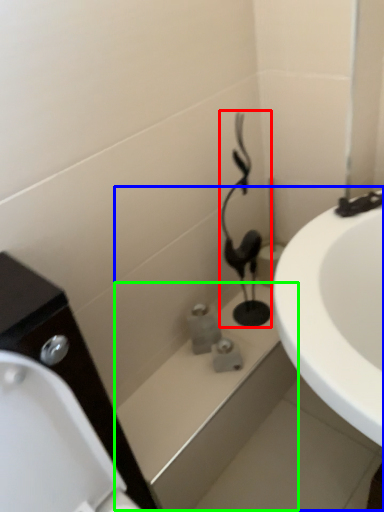
Question: Considering the real-world distances, which object is closest to plumbing fixture (highlighted by a red box)? bath (highlighted by a blue box) or bath (highlighted by a green box).

Choices:
 (A) bath
 (B) bath

Answer: (A)